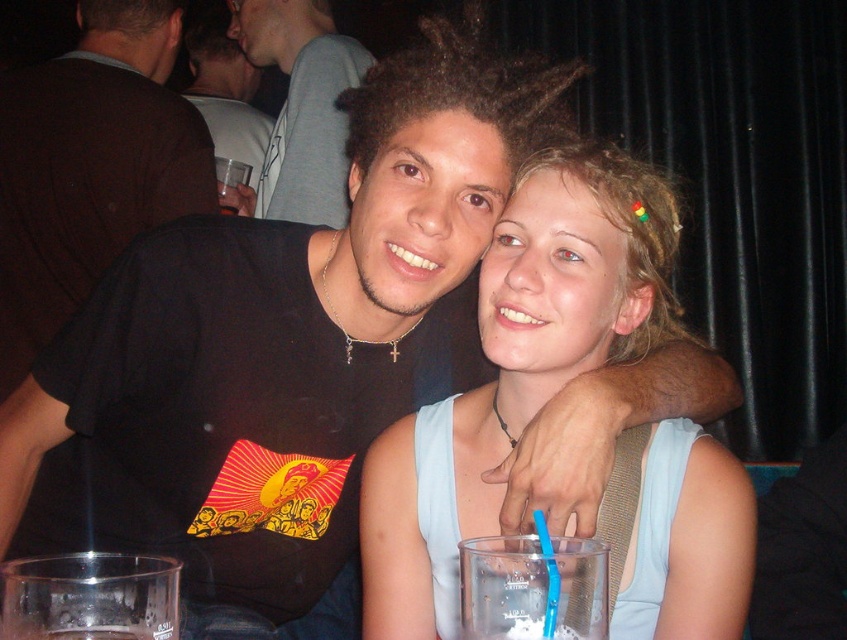
Question: Is black matte t-shirt at upper left above matte black shirt at upper center?

Choices:
 (A) no
 (B) yes

Answer: (A)

Question: Can you confirm if light blue fabric dress at center is thinner than matte black shirt at upper center?

Choices:
 (A) yes
 (B) no

Answer: (A)

Question: Which of these objects is positioned closest to the matte black shirt at upper center?

Choices:
 (A) black t-shirt at center
 (B) light blue fabric dress at center
 (C) black matte t-shirt at upper left

Answer: (A)

Question: Which point is closer to the camera?

Choices:
 (A) light blue fabric dress at center
 (B) black t-shirt at center
 (C) matte black shirt at upper center

Answer: (A)

Question: Considering the real-world distances, which object is closest to the matte black shirt at upper center?

Choices:
 (A) black t-shirt at center
 (B) black matte t-shirt at upper left
 (C) light blue fabric dress at center

Answer: (A)

Question: Is black matte t-shirt at upper left to the left of black t-shirt at center from the viewer's perspective?

Choices:
 (A) yes
 (B) no

Answer: (A)